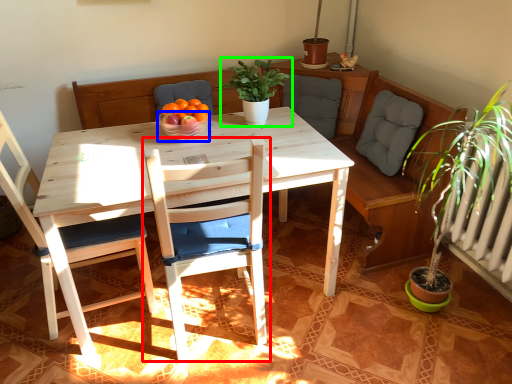
Question: Which is nearer to the chair (highlighted by a red box)? glass bowl (highlighted by a blue box) or houseplant (highlighted by a green box).

Choices:
 (A) glass bowl
 (B) houseplant

Answer: (A)